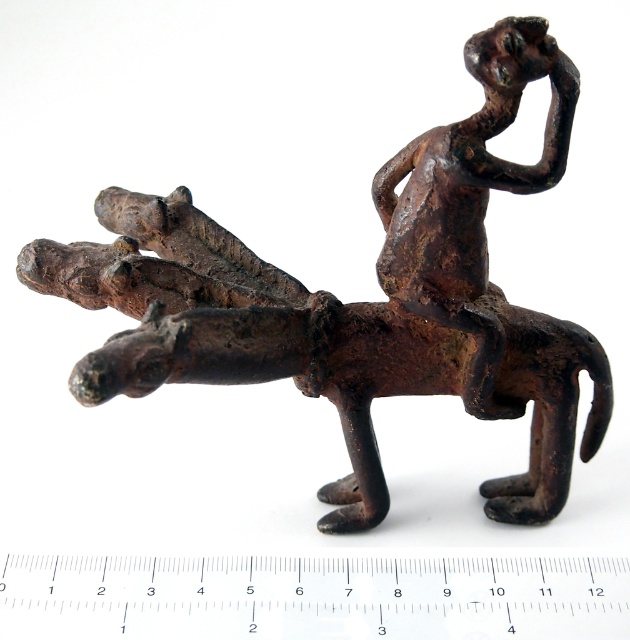
Question: From the image, what is the correct spatial relationship of metallic ruler at center in relation to rusty metal figure at upper right?

Choices:
 (A) right
 (B) left

Answer: (B)

Question: Is metallic ruler at center positioned behind rusty metal figure at upper right?

Choices:
 (A) yes
 (B) no

Answer: (A)

Question: Can you confirm if metallic ruler at center is bigger than rusty metal figure at upper right?

Choices:
 (A) no
 (B) yes

Answer: (A)

Question: Which point is closer to the camera?

Choices:
 (A) metallic ruler at center
 (B) rusty metal figure at upper right

Answer: (B)

Question: Which point appears farthest from the camera in this image?

Choices:
 (A) (595, 580)
 (B) (517, 36)

Answer: (A)